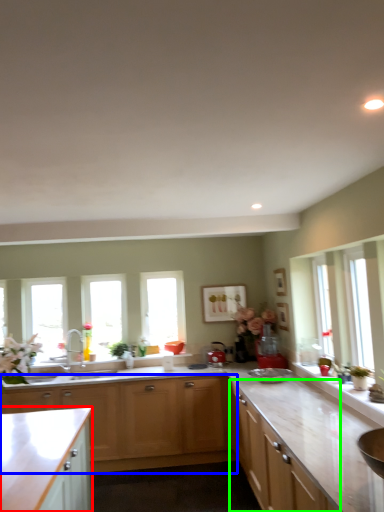
Question: Which object is positioned farthest from cabinetry (highlighted by a red box)? Select from cabinetry (highlighted by a blue box) and cabinetry (highlighted by a green box).

Choices:
 (A) cabinetry
 (B) cabinetry

Answer: (B)